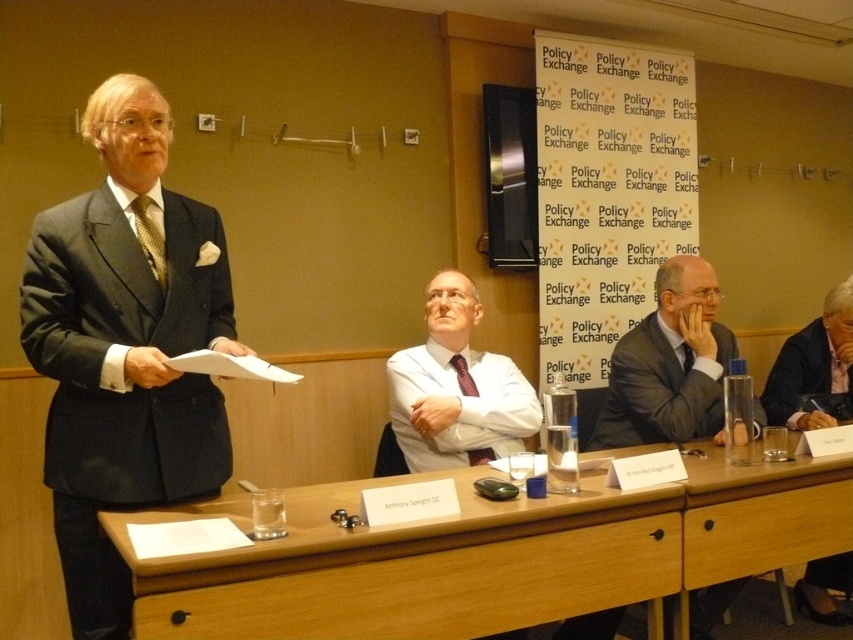
Is pink fabric suit at right shorter than matte red tie at center?

Incorrect, pink fabric suit at right's height does not fall short of matte red tie at center's.

The image size is (853, 640). What do you see at coordinates (814, 369) in the screenshot? I see `pink fabric suit at right` at bounding box center [814, 369].

Where is `pink fabric suit at right`? The image size is (853, 640). pink fabric suit at right is located at coordinates (814, 369).

Does white shirt at center have a larger size compared to pink fabric suit at right?

No.

Who is lower down, white shirt at center or pink fabric suit at right?

pink fabric suit at right

Is point (479, 378) in front of point (802, 340)?

That is True.

Identify the location of white shirt at center. The width and height of the screenshot is (853, 640). (454, 390).

Measure the distance between matte gray suit at center and camera.

matte gray suit at center is 2.42 meters away from camera.

Can you confirm if matte gray suit at center is positioned below matte red tie at center?

Actually, matte gray suit at center is above matte red tie at center.

Is point (685, 260) positioned before point (468, 451)?

No, it is not.

The height and width of the screenshot is (640, 853). Find the location of `matte gray suit at center`. matte gray suit at center is located at coordinates (669, 364).